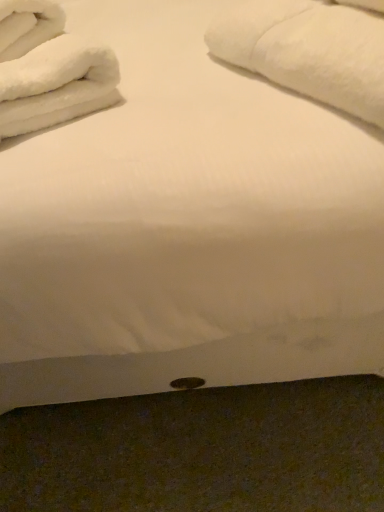
Question: Should I look upward or downward to see white fluffy towels at upper left, placed as the 1th bath towel when sorted from left to right?

Choices:
 (A) up
 (B) down

Answer: (A)

Question: Is white soft towel at upper right, the first bath towel in the right-to-left sequence, further to camera compared to white fluffy towels at upper left, positioned as the second bath towel in right-to-left order?

Choices:
 (A) no
 (B) yes

Answer: (A)

Question: Does white soft towel at upper right, the first bath towel in the right-to-left sequence, lie in front of white fluffy towels at upper left, placed as the 1th bath towel when sorted from left to right?

Choices:
 (A) no
 (B) yes

Answer: (B)

Question: Is white soft towel at upper right, the first bath towel in the right-to-left sequence, completely or partially outside of white fluffy towels at upper left, placed as the 1th bath towel when sorted from left to right?

Choices:
 (A) no
 (B) yes

Answer: (B)

Question: Can you confirm if white soft towel at upper right, the first bath towel in the right-to-left sequence, is thinner than white fluffy towels at upper left, placed as the 1th bath towel when sorted from left to right?

Choices:
 (A) yes
 (B) no

Answer: (A)

Question: Does white soft towel at upper right, the first bath towel in the right-to-left sequence, have a greater height compared to white fluffy towels at upper left, positioned as the second bath towel in right-to-left order?

Choices:
 (A) no
 (B) yes

Answer: (B)

Question: From a real-world perspective, does white soft towel at upper right, which appears as the second bath towel when viewed from the left, sit lower than white fluffy towels at upper left, placed as the 1th bath towel when sorted from left to right?

Choices:
 (A) yes
 (B) no

Answer: (B)

Question: Is white fluffy towels at upper left, placed as the 1th bath towel when sorted from left to right, aimed at white soft towel at upper right, the first bath towel in the right-to-left sequence?

Choices:
 (A) yes
 (B) no

Answer: (B)

Question: Are white fluffy towels at upper left, positioned as the second bath towel in right-to-left order, and white soft towel at upper right, the first bath towel in the right-to-left sequence, far apart?

Choices:
 (A) yes
 (B) no

Answer: (B)

Question: Is white soft towel at upper right, which appears as the second bath towel when viewed from the left, surrounded by white fluffy towels at upper left, positioned as the second bath towel in right-to-left order?

Choices:
 (A) yes
 (B) no

Answer: (B)

Question: Is white fluffy towels at upper left, placed as the 1th bath towel when sorted from left to right, positioned beyond the bounds of white soft towel at upper right, the first bath towel in the right-to-left sequence?

Choices:
 (A) yes
 (B) no

Answer: (A)

Question: Is white fluffy towels at upper left, positioned as the second bath towel in right-to-left order, taller than white soft towel at upper right, the first bath towel in the right-to-left sequence?

Choices:
 (A) yes
 (B) no

Answer: (B)

Question: Is the position of white fluffy towels at upper left, positioned as the second bath towel in right-to-left order, more distant than that of white soft towel at upper right, which appears as the second bath towel when viewed from the left?

Choices:
 (A) no
 (B) yes

Answer: (B)

Question: In the image, is white soft towel at upper right, which appears as the second bath towel when viewed from the left, on the left side or the right side of white fluffy towels at upper left, positioned as the second bath towel in right-to-left order?

Choices:
 (A) right
 (B) left

Answer: (A)